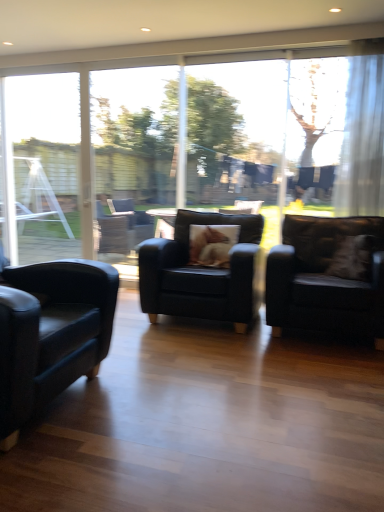
Describe the element at coordinates (51, 332) in the screenshot. I see `matte black armchair at left, placed as the first chair when sorted from left to right` at that location.

In order to face matte black armchair at right, the 1th chair in the right-to-left sequence, should I rotate leftwards or rightwards?

Turn right by 17.962 degrees to look at matte black armchair at right, the 1th chair in the right-to-left sequence.

In the scene shown: Measure the distance between point (147, 173) and camera.

The depth of point (147, 173) is 5.93 meters.

This screenshot has height=512, width=384. I want to click on brown furry pillow at center, so click(x=204, y=242).

What do you see at coordinates (204, 242) in the screenshot? I see `brown furry pillow at center` at bounding box center [204, 242].

Identify the location of matte black armchair at left, acting as the third chair starting from the right. The height and width of the screenshot is (512, 384). (51, 332).

Which object is positioned more to the left, white sheer curtain at upper right or matte black armchair at center, arranged as the second chair when viewed from the left?

Positioned to the left is matte black armchair at center, arranged as the second chair when viewed from the left.

In the scene shown: From the image's perspective, which one is positioned lower, white sheer curtain at upper right or matte black armchair at center, the second chair from the right?

matte black armchair at center, the second chair from the right, appears lower in the image.

From a real-world perspective, is white sheer curtain at upper right under matte black armchair at center, the second chair from the right?

No, from a real-world perspective, white sheer curtain at upper right is not under matte black armchair at center, the second chair from the right.

Which of these two, white sheer curtain at upper right or matte black armchair at center, the second chair from the right, is wider?

Wider between the two is matte black armchair at center, the second chair from the right.

Which of these two, matte black armchair at right, which is the 3th chair from left to right, or clear glass window frame at left, is thinner?

Thinner between the two is clear glass window frame at left.

From the image's perspective, would you say matte black armchair at right, which is the 3th chair from left to right, is shown under clear glass window frame at left?

Indeed, from the image's perspective, matte black armchair at right, which is the 3th chair from left to right, is shown beneath clear glass window frame at left.

Is matte black armchair at right, the 1th chair in the right-to-left sequence, spatially inside clear glass window frame at left, or outside of it?

matte black armchair at right, the 1th chair in the right-to-left sequence, lies outside clear glass window frame at left.

Is point (336, 284) farther from viewer compared to point (70, 158)?

That is False.

Considering the relative sizes of matte black armchair at left, acting as the third chair starting from the right, and matte black armchair at center, the second chair from the right, in the image provided, is matte black armchair at left, acting as the third chair starting from the right, smaller than matte black armchair at center, the second chair from the right,?

Yes.

How different are the orientations of matte black armchair at left, acting as the third chair starting from the right, and matte black armchair at center, the second chair from the right, in degrees?

matte black armchair at left, acting as the third chair starting from the right, and matte black armchair at center, the second chair from the right, are facing 89.9 degrees away from each other.

Which point is more forward, (x=30, y=337) or (x=191, y=301)?

Positioned in front is point (x=30, y=337).

Can you confirm if matte black armchair at left, placed as the first chair when sorted from left to right, is wider than matte black armchair at center, the second chair from the right?

Incorrect, the width of matte black armchair at left, placed as the first chair when sorted from left to right, does not surpass that of matte black armchair at center, the second chair from the right.

Considering the relative sizes of white sheer curtain at upper right and matte black armchair at right, the 1th chair in the right-to-left sequence, in the image provided, is white sheer curtain at upper right thinner than matte black armchair at right, the 1th chair in the right-to-left sequence,?

Yes.

Where is `curtain above the matte black armchair at right, which is the 3th chair from left to right (from a real-world perspective)`? The height and width of the screenshot is (512, 384). curtain above the matte black armchair at right, which is the 3th chair from left to right (from a real-world perspective) is located at coordinates (362, 141).

Considering the relative sizes of white sheer curtain at upper right and matte black armchair at right, which is the 3th chair from left to right, in the image provided, is white sheer curtain at upper right shorter than matte black armchair at right, which is the 3th chair from left to right,?

In fact, white sheer curtain at upper right may be taller than matte black armchair at right, which is the 3th chair from left to right.

Which is in front, point (358, 227) or point (212, 230)?

The point (358, 227) is more forward.

You are a GUI agent. You are given a task and a screenshot of the screen. Output one action in this format:
    pyautogui.click(x=<x>, y=<y>)
    Task: Click on the animal behind the matte black armchair at right, which is the 3th chair from left to right
    This screenshot has height=512, width=384.
    Given the screenshot: What is the action you would take?
    pyautogui.click(x=204, y=242)

Which is behind, matte black armchair at right, which is the 3th chair from left to right, or brown furry pillow at center?

brown furry pillow at center.

Which of these two, matte black armchair at right, the 1th chair in the right-to-left sequence, or brown furry pillow at center, is bigger?

matte black armchair at right, the 1th chair in the right-to-left sequence, is bigger.

Which object is positioned more to the left, brown furry pillow at center or clear glass window frame at left?

From the viewer's perspective, clear glass window frame at left appears more on the left side.

Is brown furry pillow at center smaller than clear glass window frame at left?

Yes.

From a real-world perspective, is brown furry pillow at center positioned above or below clear glass window frame at left?

brown furry pillow at center is situated lower than clear glass window frame at left in the real world.

From the image's perspective, is matte black armchair at center, the second chair from the right, located above or below matte black armchair at left, acting as the third chair starting from the right?

From the image's perspective, matte black armchair at center, the second chair from the right, appears above matte black armchair at left, acting as the third chair starting from the right.

What's the angular difference between matte black armchair at center, the second chair from the right, and matte black armchair at left, placed as the first chair when sorted from left to right,'s facing directions?

There is a 89.9-degree angle between the facing directions of matte black armchair at center, the second chair from the right, and matte black armchair at left, placed as the first chair when sorted from left to right.

From a real-world perspective, is matte black armchair at center, the second chair from the right, above or below matte black armchair at left, placed as the first chair when sorted from left to right?

Clearly, from a real-world perspective, matte black armchair at center, the second chair from the right, is below matte black armchair at left, placed as the first chair when sorted from left to right.

Does point (186, 261) appear closer or farther from the camera than point (117, 290)?

Point (186, 261).

You are a GUI agent. You are given a task and a screenshot of the screen. Output one action in this format:
    pyautogui.click(x=<x>, y=<y>)
    Task: Click on the curtain that is above the matte black armchair at center, the second chair from the right (from the image's perspective)
    The image size is (384, 512).
    Given the screenshot: What is the action you would take?
    pyautogui.click(x=362, y=141)

There is a clear glass window frame at left. Where is `the 3rd chair below it (from a real-world perspective)`? This screenshot has height=512, width=384. the 3rd chair below it (from a real-world perspective) is located at coordinates (328, 277).

Considering their positions, is brown furry pillow at center positioned further to white sheer curtain at upper right than transparent glass screen door at center?

Based on the image, transparent glass screen door at center appears to be further to white sheer curtain at upper right.

Looking at the image, which one is located closer to matte black armchair at center, arranged as the second chair when viewed from the left, transparent glass screen door at center or brown furry pillow at center?

The object closer to matte black armchair at center, arranged as the second chair when viewed from the left, is brown furry pillow at center.

Estimate the real-world distances between objects in this image. Which object is closer to brown furry pillow at center, white sheer curtain at upper right or matte black armchair at right, the 1th chair in the right-to-left sequence?

matte black armchair at right, the 1th chair in the right-to-left sequence, lies closer to brown furry pillow at center than the other object.

When comparing their distances from transparent glass screen door at center, does clear glass window frame at left or velvet beige pillow at right seem further?

Among the two, velvet beige pillow at right is located further to transparent glass screen door at center.

Looking at the image, which one is located further to velvet beige pillow at right, clear glass window frame at left or white sheer curtain at upper right?

clear glass window frame at left.

Based on their spatial positions, is transparent glass screen door at center or clear glass window frame at left further from velvet beige pillow at right?

Based on the image, clear glass window frame at left appears to be further to velvet beige pillow at right.

Considering their positions, is matte black armchair at center, the second chair from the right, positioned closer to clear glass window frame at left than velvet beige pillow at right?

The object closer to clear glass window frame at left is matte black armchair at center, the second chair from the right.

Which object lies further to the anchor point clear glass window frame at left, matte black armchair at right, the 1th chair in the right-to-left sequence, or velvet beige pillow at right?

velvet beige pillow at right lies further to clear glass window frame at left than the other object.

Where is `screen door between clear glass window frame at left and velvet beige pillow at right from left to right`? The image size is (384, 512). screen door between clear glass window frame at left and velvet beige pillow at right from left to right is located at coordinates (131, 135).

At what (x,y) coordinates should I click in order to perform the action: click on screen door situated between clear glass window frame at left and matte black armchair at center, arranged as the second chair when viewed from the left, from left to right. Please return your answer as a coordinate pair (x, y). Looking at the image, I should click on (131, 135).

You are a GUI agent. You are given a task and a screenshot of the screen. Output one action in this format:
    pyautogui.click(x=<x>, y=<y>)
    Task: Click on the pillow between white sheer curtain at upper right and matte black armchair at right, the 1th chair in the right-to-left sequence, in the up-down direction
    The width and height of the screenshot is (384, 512).
    Given the screenshot: What is the action you would take?
    pyautogui.click(x=353, y=258)

Find the location of a particular element. chair between matte black armchair at left, acting as the third chair starting from the right, and matte black armchair at right, the 1th chair in the right-to-left sequence, in the horizontal direction is located at coordinates (202, 274).